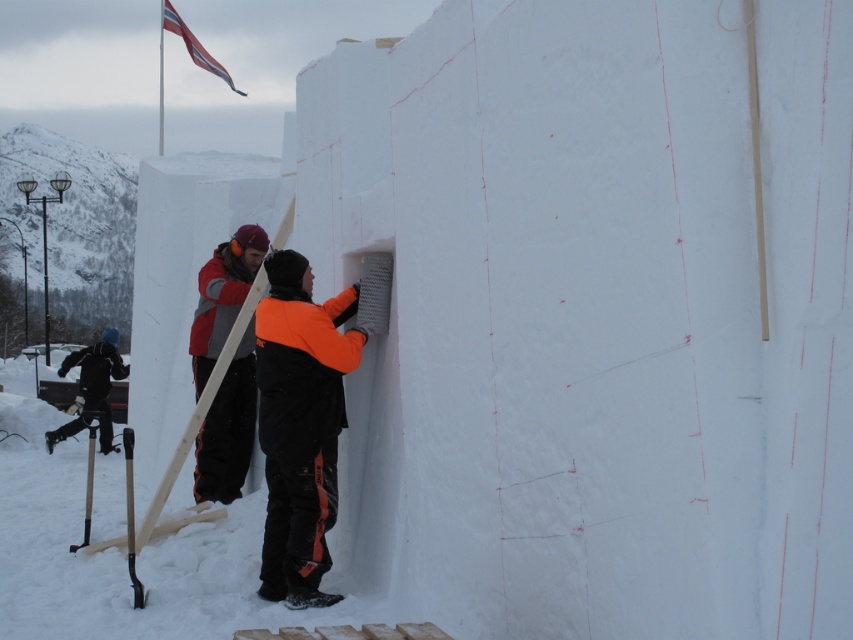
Based on the photo, you are planning to take a photo of the orange fleece jacket at center and the red fabric flag at upper left. Which object should you focus on first if you want to capture both in the same frame without moving the camera?

You should focus on the orange fleece jacket at center first because it is thinner than the red fabric flag at upper left, allowing for better depth of field to include both in the frame.

You are a construction worker standing at the origin point of the coordinate system. You need to place a tool at the location of the red jacket at center. What are the coordinates where you should place the tool?

The coordinates for placing the tool at the location of the red jacket at center are exactly at point (228, 429).

Consider the image. You are standing in front of the snow structure and notice two points marked on the wall. Which of the two points, point 1 at coordinates point (111, 355) or point 2 at coordinates point (192, 54), is closer to you?

Point 1 at coordinates point (111, 355) is closer to the viewer than point 2 at coordinates point (192, 54).